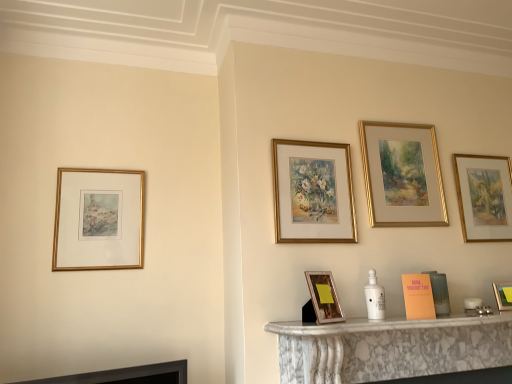
Question: Which direction should I rotate to look at gold-framed painting at upper center, placed as the 3th picture frame when sorted from right to left, — up or down?

Choices:
 (A) up
 (B) down

Answer: (A)

Question: Is gold-framed painting at upper right, the sixth picture frame when ordered from left to right, wider than gold framed print at left, positioned as the first picture frame in left-to-right order?

Choices:
 (A) yes
 (B) no

Answer: (B)

Question: Is gold-framed painting at upper right, the sixth picture frame when ordered from left to right, turned away from gold framed print at left, placed as the 6th picture frame when sorted from right to left?

Choices:
 (A) yes
 (B) no

Answer: (B)

Question: Does gold-framed painting at upper right, which appears as the first picture frame when viewed from the right, turn towards gold framed print at left, placed as the 6th picture frame when sorted from right to left?

Choices:
 (A) yes
 (B) no

Answer: (B)

Question: From the image's perspective, is gold-framed painting at upper right, the sixth picture frame when ordered from left to right, beneath gold framed print at left, positioned as the first picture frame in left-to-right order?

Choices:
 (A) no
 (B) yes

Answer: (A)

Question: Does gold-framed painting at upper right, which appears as the first picture frame when viewed from the right, have a greater height compared to gold framed print at left, placed as the 6th picture frame when sorted from right to left?

Choices:
 (A) yes
 (B) no

Answer: (A)

Question: Does gold-framed painting at upper right, the sixth picture frame when ordered from left to right, lie behind gold framed print at left, placed as the 6th picture frame when sorted from right to left?

Choices:
 (A) yes
 (B) no

Answer: (A)

Question: Is there a large distance between matte gold picture frame at right, positioned as the 2th picture frame in right-to-left order, and gold/gilded frame at center, the fourth picture frame in the right-to-left sequence?

Choices:
 (A) no
 (B) yes

Answer: (B)

Question: Is matte gold picture frame at right, acting as the fifth picture frame starting from the left, smaller than gold/gilded frame at center, the fourth picture frame in the right-to-left sequence?

Choices:
 (A) yes
 (B) no

Answer: (A)

Question: Considering the relative positions of matte gold picture frame at right, acting as the fifth picture frame starting from the left, and gold/gilded frame at center, marked as the 3th picture frame in a left-to-right arrangement, in the image provided, is matte gold picture frame at right, acting as the fifth picture frame starting from the left, to the right of gold/gilded frame at center, marked as the 3th picture frame in a left-to-right arrangement, from the viewer's perspective?

Choices:
 (A) no
 (B) yes

Answer: (B)

Question: Does matte gold picture frame at right, acting as the fifth picture frame starting from the left, come in front of gold/gilded frame at center, the fourth picture frame in the right-to-left sequence?

Choices:
 (A) no
 (B) yes

Answer: (A)

Question: Is the surface of matte gold picture frame at right, acting as the fifth picture frame starting from the left, in direct contact with gold/gilded frame at center, marked as the 3th picture frame in a left-to-right arrangement?

Choices:
 (A) no
 (B) yes

Answer: (A)

Question: From a real-world perspective, is matte gold picture frame at right, positioned as the 2th picture frame in right-to-left order, positioned over gold/gilded frame at center, marked as the 3th picture frame in a left-to-right arrangement, based on gravity?

Choices:
 (A) no
 (B) yes

Answer: (A)

Question: Is gold/gilded frame at center, the fourth picture frame in the right-to-left sequence, looking in the opposite direction of matte gold picture frame at right, acting as the fifth picture frame starting from the left?

Choices:
 (A) yes
 (B) no

Answer: (B)